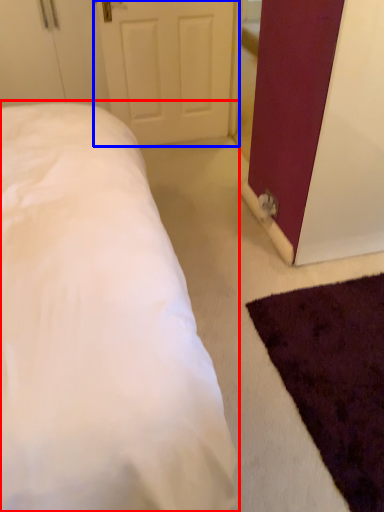
Question: Among these objects, which one is nearest to the camera, bed (highlighted by a red box) or door (highlighted by a blue box)?

Choices:
 (A) bed
 (B) door

Answer: (A)